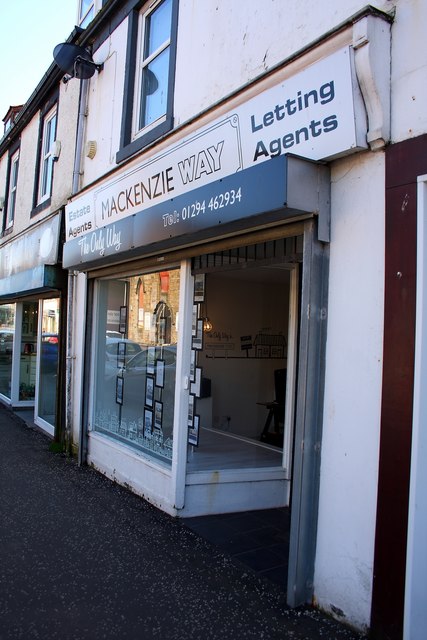
Find the location of a particular element. The width and height of the screenshot is (427, 640). chair is located at coordinates (274, 404).